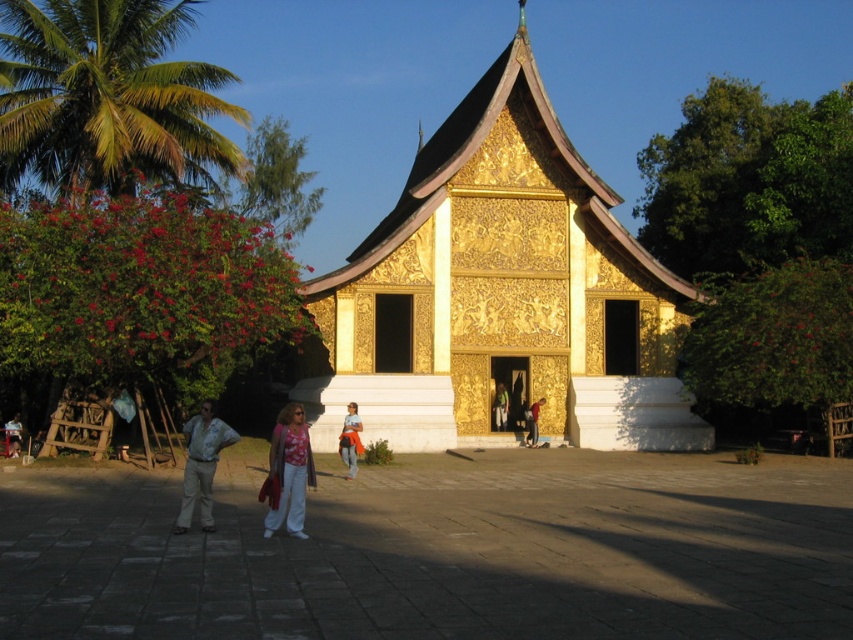
Question: Which object is closer to the camera taking this photo?

Choices:
 (A) matte pink blouse at center
 (B) light beige pants at lower left
 (C) white cotton shirt at lower left

Answer: (A)

Question: Does matte pink blouse at center have a greater width compared to orange fabric bag at center?

Choices:
 (A) yes
 (B) no

Answer: (A)

Question: Does gold textured palace at center appear on the left side of matte gold person at center?

Choices:
 (A) no
 (B) yes

Answer: (B)

Question: Which object appears farthest from the camera in this image?

Choices:
 (A) matte gold person at center
 (B) green fabric at center

Answer: (B)

Question: Which point appears farthest from the camera in this image?

Choices:
 (A) (352, 449)
 (B) (12, 448)
 (C) (534, 404)

Answer: (C)

Question: Can you confirm if gold textured palace at center is smaller than matte gold person at center?

Choices:
 (A) no
 (B) yes

Answer: (A)